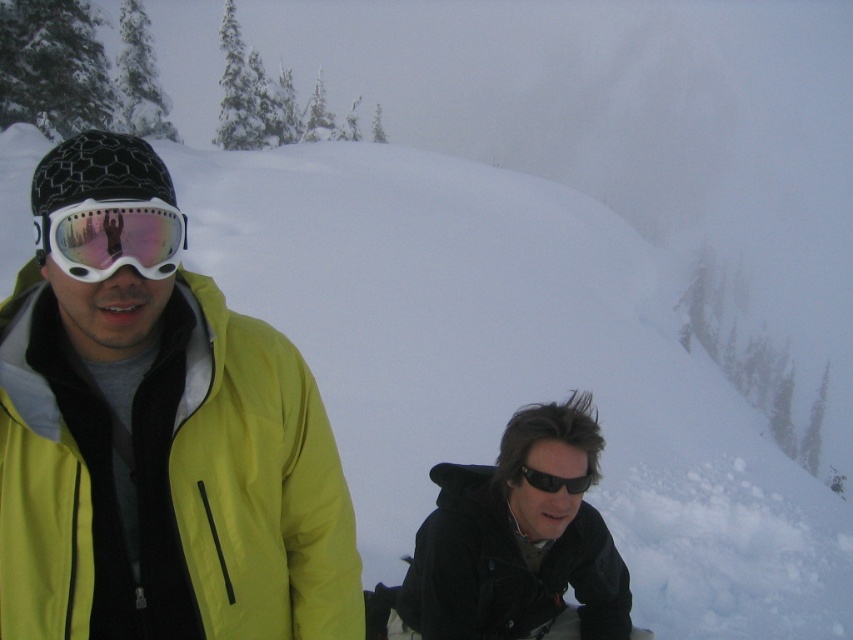
Question: Which is nearer to the matte white goggles at left?

Choices:
 (A) matte yellow jacket at left
 (B) black matte jacket at lower right

Answer: (A)

Question: Estimate the real-world distances between objects in this image. Which object is farther from the matte yellow jacket at left?

Choices:
 (A) black reflective sunglasses at lower center
 (B) black matte jacket at lower right
 (C) matte white goggles at left

Answer: (B)

Question: Which point is closer to the camera?

Choices:
 (A) black reflective sunglasses at lower center
 (B) black matte jacket at lower right

Answer: (A)

Question: Does matte yellow jacket at left have a larger size compared to black reflective sunglasses at lower center?

Choices:
 (A) yes
 (B) no

Answer: (A)

Question: Can you confirm if matte yellow jacket at left is positioned to the left of black reflective sunglasses at lower center?

Choices:
 (A) yes
 (B) no

Answer: (A)

Question: Considering the relative positions of black matte jacket at lower right and black reflective sunglasses at lower center in the image provided, where is black matte jacket at lower right located with respect to black reflective sunglasses at lower center?

Choices:
 (A) above
 (B) below

Answer: (B)